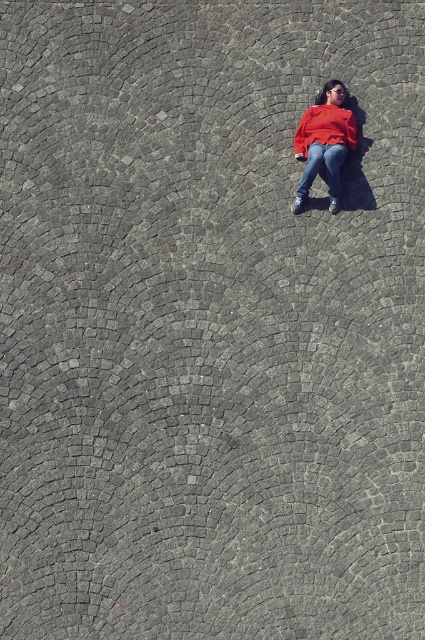
Can you confirm if matte red sweater at center is smaller than matte red sweatshirt at center?

No.

Can you confirm if matte red sweater at center is taller than matte red sweatshirt at center?

Yes.

You are a GUI agent. You are given a task and a screenshot of the screen. Output one action in this format:
    pyautogui.click(x=<x>, y=<y>)
    Task: Click on the matte red sweater at center
    Image resolution: width=425 pixels, height=640 pixels.
    Given the screenshot: What is the action you would take?
    pyautogui.click(x=323, y=141)

Is matte red sweatshirt at center to the right of jeans at center from the viewer's perspective?

Indeed, matte red sweatshirt at center is positioned on the right side of jeans at center.

Is point (320, 134) closer to camera compared to point (340, 150)?

No, (320, 134) is further to viewer.

Measure the distance between matte red sweatshirt at center and camera.

42.11 feet

Find the location of a particular element. This screenshot has height=640, width=425. matte red sweatshirt at center is located at coordinates (325, 128).

Looking at this image, does matte red sweater at center have a larger size compared to jeans at center?

Correct, matte red sweater at center is larger in size than jeans at center.

Between matte red sweater at center and jeans at center, which one appears on the right side from the viewer's perspective?

Positioned to the right is matte red sweater at center.

Is point (319, 140) behind point (320, 161)?

Yes, point (319, 140) is behind point (320, 161).

Locate an element on the screen. matte red sweater at center is located at coordinates (323, 141).